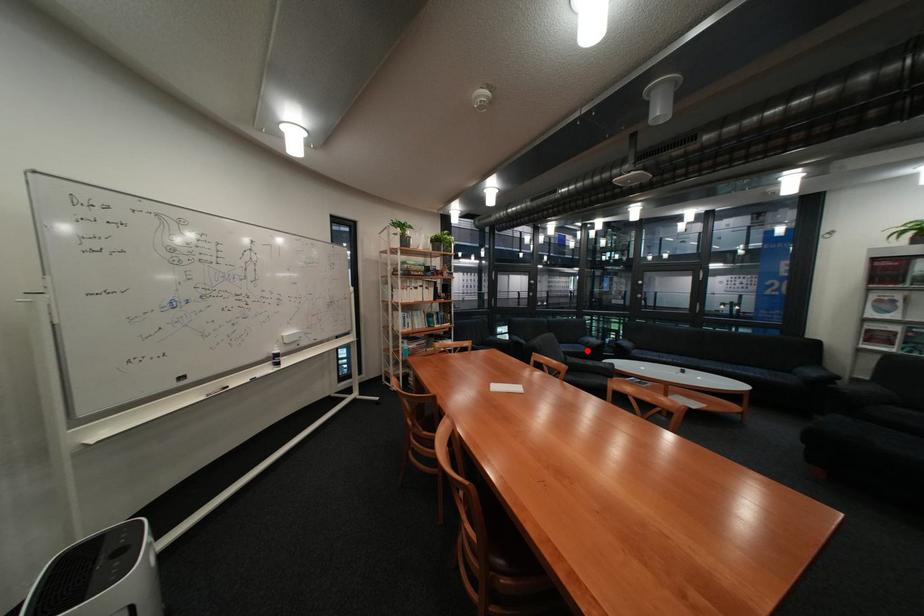
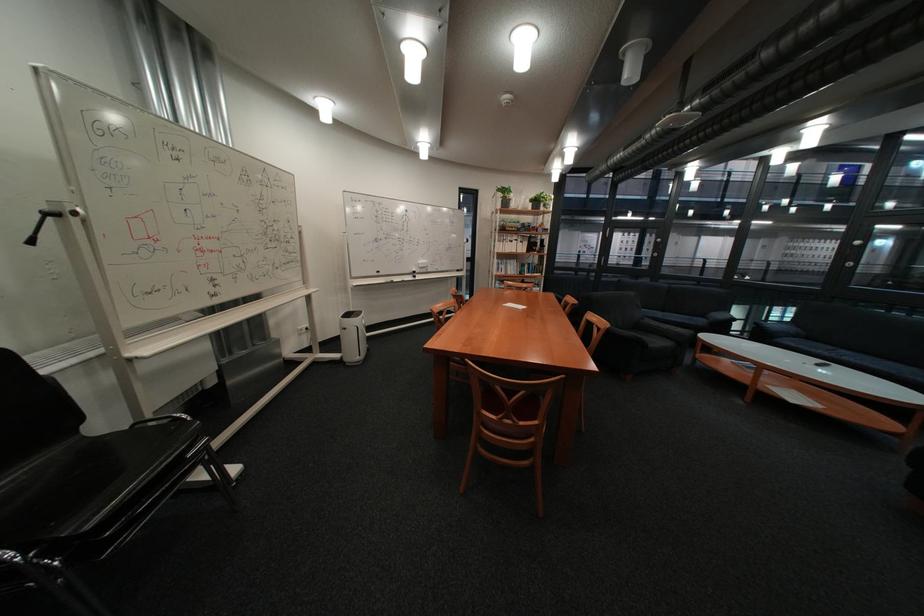
Question: I am providing you with two images of the same scene from different viewpoints. In image1, a red point is highlighted. Considering the same 3D point in image2, which of the following is correct?

Choices:
 (A) It is closer
 (B) It is farther

Answer: (A)